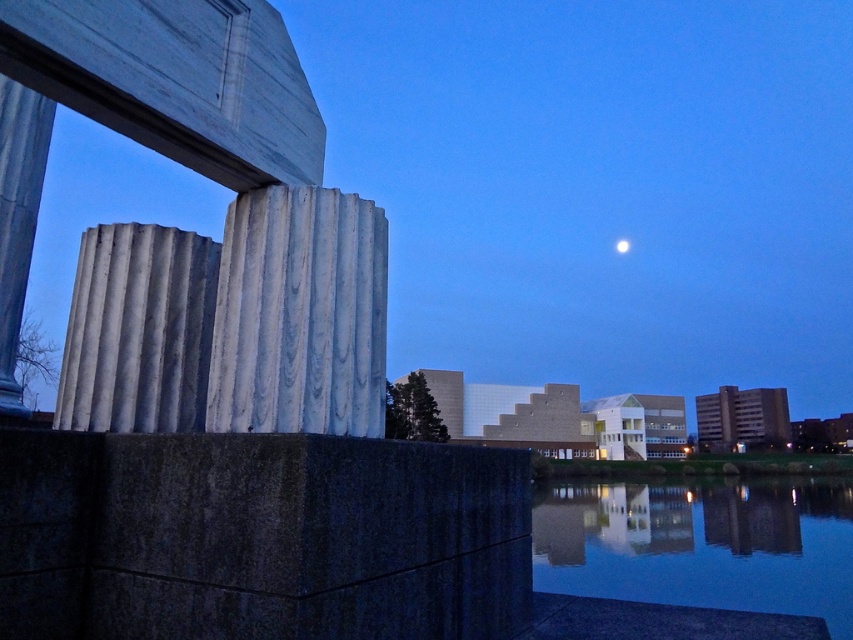
Question: Among these objects, which one is nearest to the camera?

Choices:
 (A) white glossy moon at upper center
 (B) white corrugated concrete pillar at left
 (C) white marble column at center
 (D) smooth reflective water at center

Answer: (C)

Question: Which point is closer to the camera?

Choices:
 (A) smooth reflective water at center
 (B) white corrugated concrete pillar at left
 (C) white marble column at center

Answer: (C)

Question: Is white marble column at center further to the viewer compared to smooth reflective water at center?

Choices:
 (A) no
 (B) yes

Answer: (A)

Question: Does smooth reflective water at center have a larger size compared to white corrugated concrete pillar at left?

Choices:
 (A) no
 (B) yes

Answer: (B)

Question: Which object is farther from the camera taking this photo?

Choices:
 (A) white marble column at center
 (B) white glossy moon at upper center

Answer: (B)

Question: Does white marble column at center have a smaller size compared to smooth reflective water at center?

Choices:
 (A) yes
 (B) no

Answer: (A)